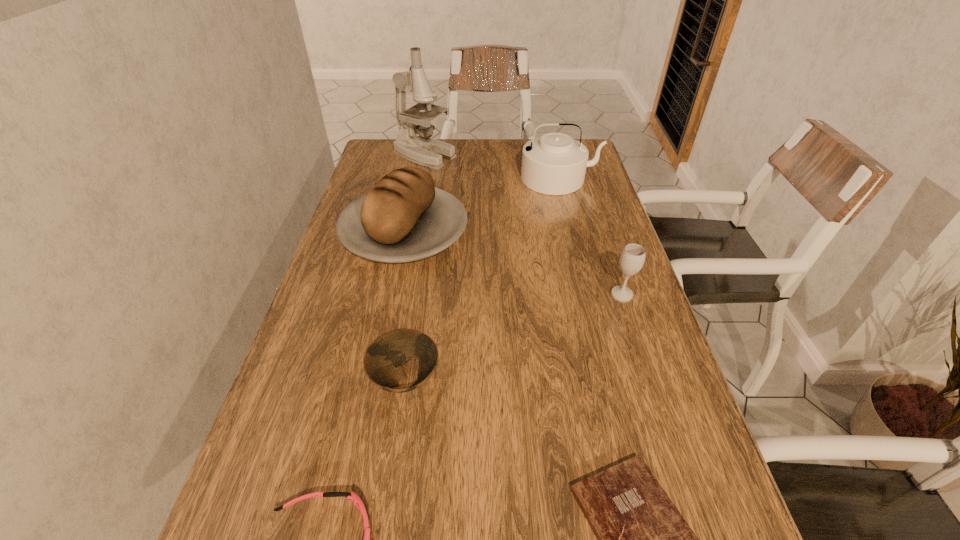
This screenshot has height=540, width=960. I want to click on object that stands as the fifth closest to the third farthest object, so click(642, 539).